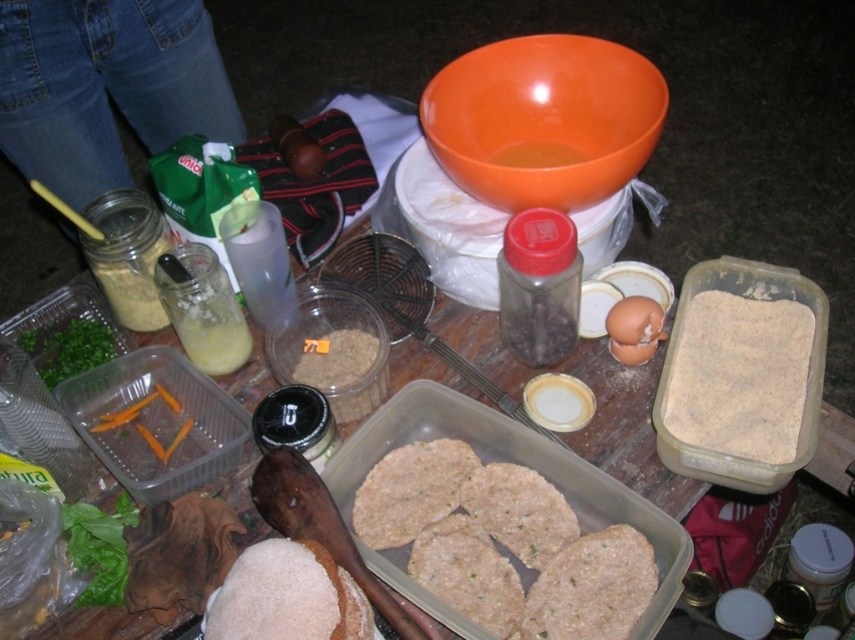
Question: Is brown textured patties at center to the right of brown powder at center from the viewer's perspective?

Choices:
 (A) yes
 (B) no

Answer: (B)

Question: Does brown textured patties at center have a larger size compared to brown powder at center?

Choices:
 (A) yes
 (B) no

Answer: (A)

Question: From the image, what is the correct spatial relationship of brown textured patties at center in relation to brown powder at center?

Choices:
 (A) below
 (B) above

Answer: (A)

Question: Which object appears farthest from the camera in this image?

Choices:
 (A) brown powder at center
 (B) brown textured patties at center

Answer: (A)

Question: Which point appears farthest from the camera in this image?

Choices:
 (A) (677, 369)
 (B) (452, 474)

Answer: (A)